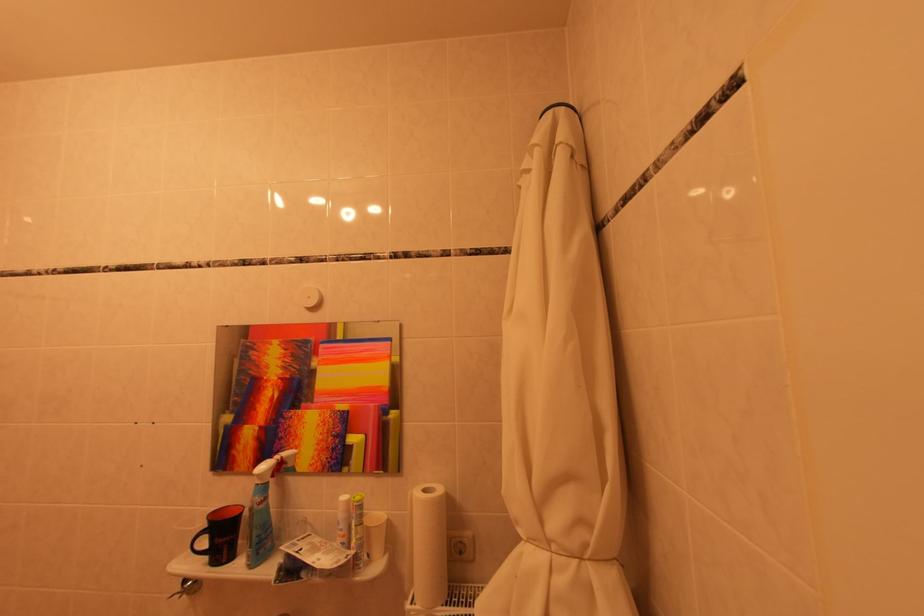
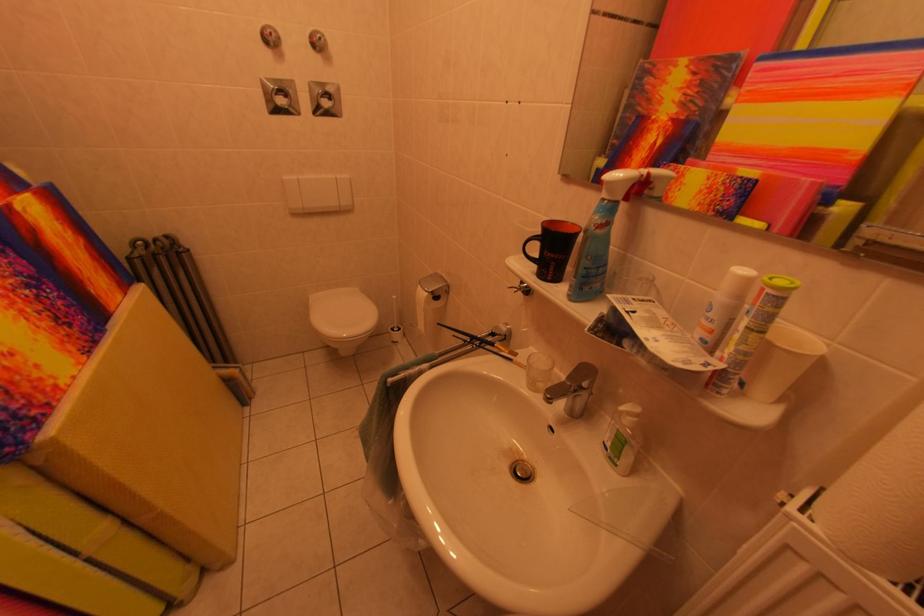
The point at [215,562] is marked in the first image. Where is the corresponding point in the second image?

(543, 270)